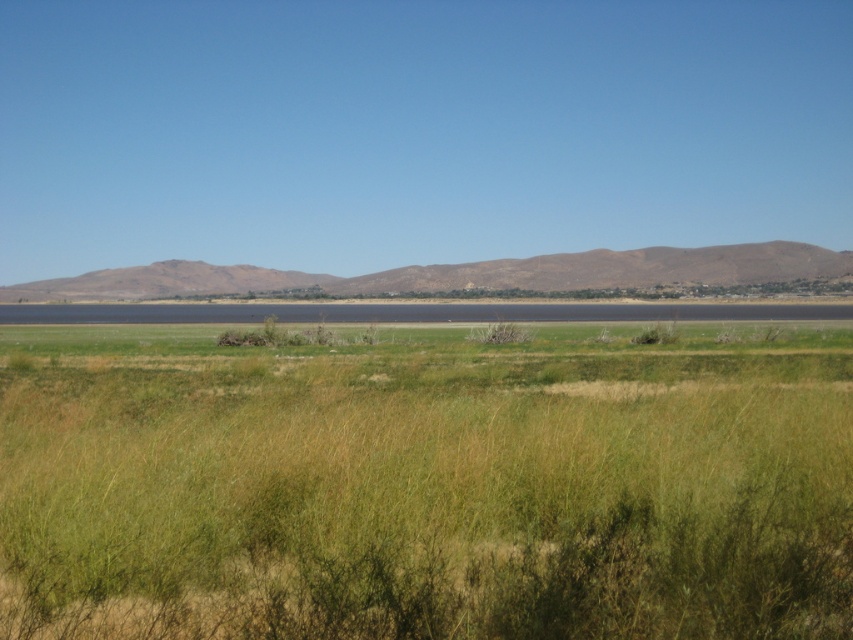
Question: Which point is closer to the camera?

Choices:
 (A) green grassy at center
 (B) brown/dry soil at center

Answer: (A)

Question: Is green grassy at center wider than brown/dry soil at center?

Choices:
 (A) yes
 (B) no

Answer: (B)

Question: Among these objects, which one is farthest from the camera?

Choices:
 (A) brown/dry soil at center
 (B) green grassy at center

Answer: (A)

Question: Can you confirm if green grassy at center is wider than brown/dry soil at center?

Choices:
 (A) no
 (B) yes

Answer: (A)

Question: Among these points, which one is farthest from the camera?

Choices:
 (A) (82, 490)
 (B) (120, 278)

Answer: (B)

Question: Can you confirm if green grassy at center is bigger than brown/dry soil at center?

Choices:
 (A) no
 (B) yes

Answer: (A)